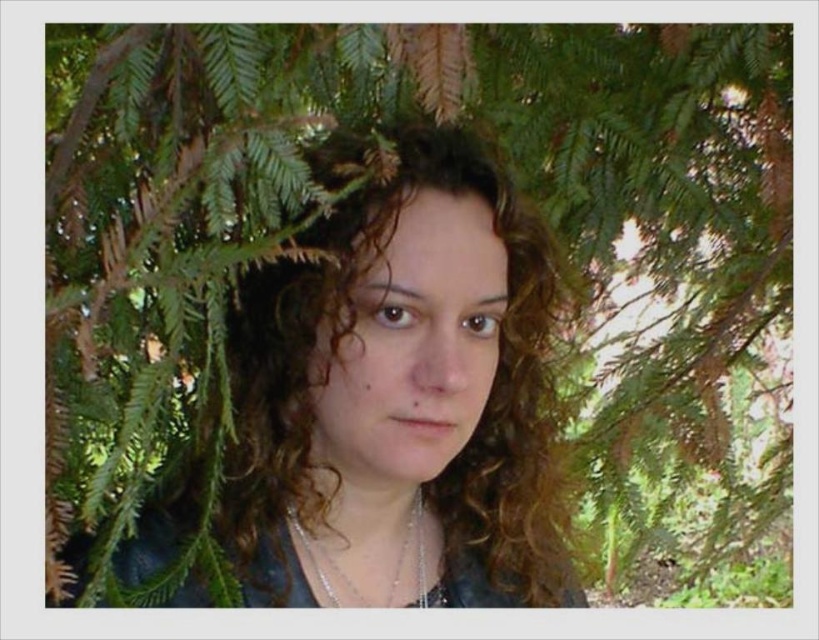
Can you confirm if curly hair at center is positioned below silver metallic necklace at center?

No, curly hair at center is not below silver metallic necklace at center.

Does point (465, 588) lie behind point (314, 572)?

Yes, it is behind point (314, 572).

The width and height of the screenshot is (819, 640). What are the coordinates of `curly hair at center` in the screenshot? It's located at (401, 400).